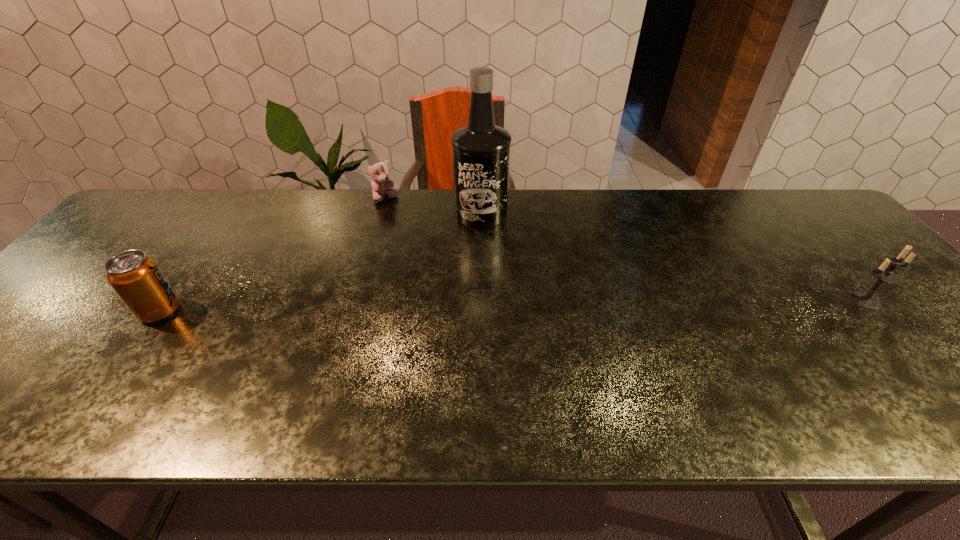
Where is `vacant space at the far left corner of the desktop`? The height and width of the screenshot is (540, 960). vacant space at the far left corner of the desktop is located at coordinates (134, 227).

The image size is (960, 540). Identify the location of free area in between the second object from right to left and the soda can. pyautogui.click(x=321, y=262).

This screenshot has height=540, width=960. In order to click on empty space between the candle holder and the third object from left to right in this screenshot , I will do `click(673, 256)`.

What are the coordinates of `free area in between the candle holder and the shortest object` in the screenshot? It's located at (626, 249).

Image resolution: width=960 pixels, height=540 pixels. Identify the location of vacant space in between the rightmost object and the soda can. (513, 305).

Identify the location of free spot between the rightmost object and the soda can. (513, 305).

Where is `free space between the leftmost object and the liquor`? The image size is (960, 540). free space between the leftmost object and the liquor is located at coordinates (321, 262).

Identify the location of vacant area that lies between the candle holder and the leftmost object. (513, 305).

This screenshot has width=960, height=540. In order to click on vacant point located between the liquor and the rightmost object in this screenshot , I will do `click(673, 256)`.

Identify the location of free space between the teddy bear and the leftmost object. [273, 255].